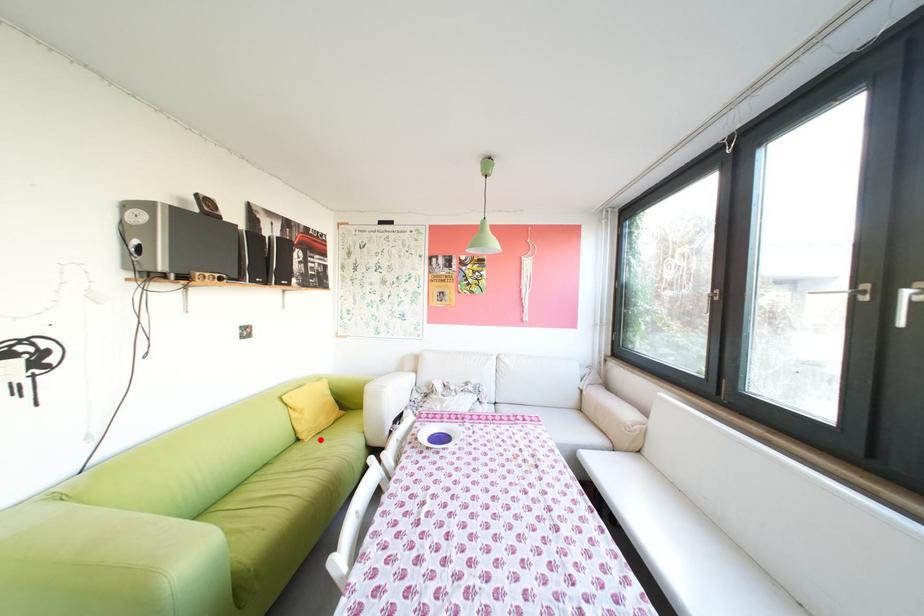
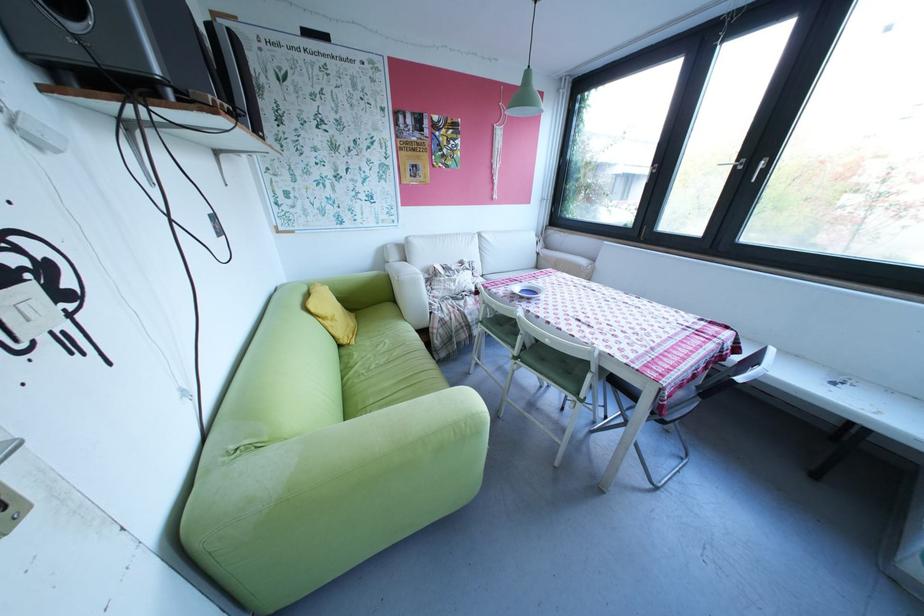
In the second image, find the point that corresponds to the highlighted location in the first image.

(366, 342)